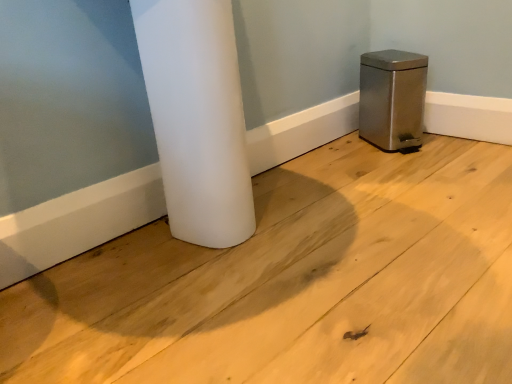
You are a GUI agent. You are given a task and a screenshot of the screen. Output one action in this format:
    pyautogui.click(x=<x>, y=<y>)
    Task: Click on the free point in front of brushed metal trash can at right
    The image size is (512, 384).
    Given the screenshot: What is the action you would take?
    pyautogui.click(x=411, y=159)